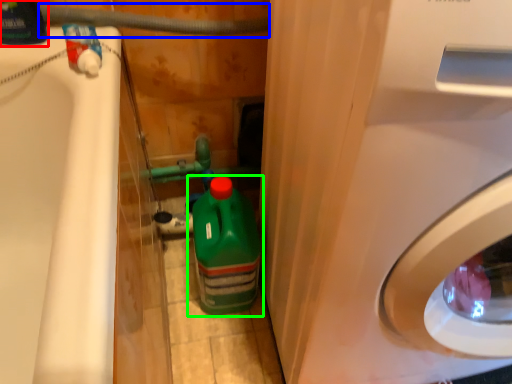
Question: Which object is the farthest from cleaning product (highlighted by a red box)? Choose among these: water pipe (highlighted by a blue box) or bottle (highlighted by a green box).

Choices:
 (A) water pipe
 (B) bottle

Answer: (B)